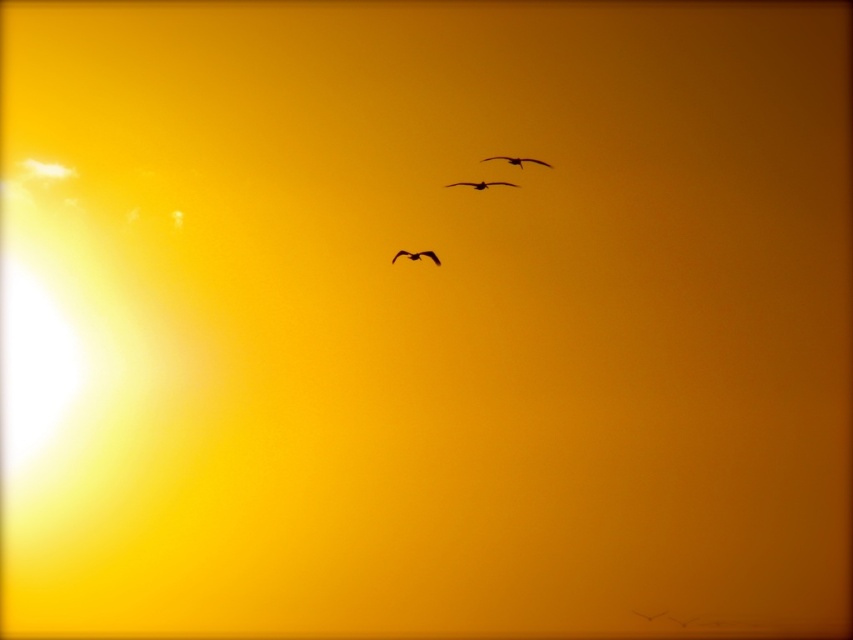
You are standing in the sunset scene and want to reach the two points marked in the image. Which point, point (537, 163) or point (421, 257), will you reach first as you move forward?

Point (537, 163) is closer to the viewer than point (421, 257), so you will reach point (537, 163) first.

You are an ornithologist observing the sunset scene. You notice two birds in the sky, the dark brown feathered bird at center and the black matte bird at center. Which bird would cast a larger shadow on the ground below?

The dark brown feathered bird at center is larger in size than the black matte bird at center, so it would cast a larger shadow on the ground below.